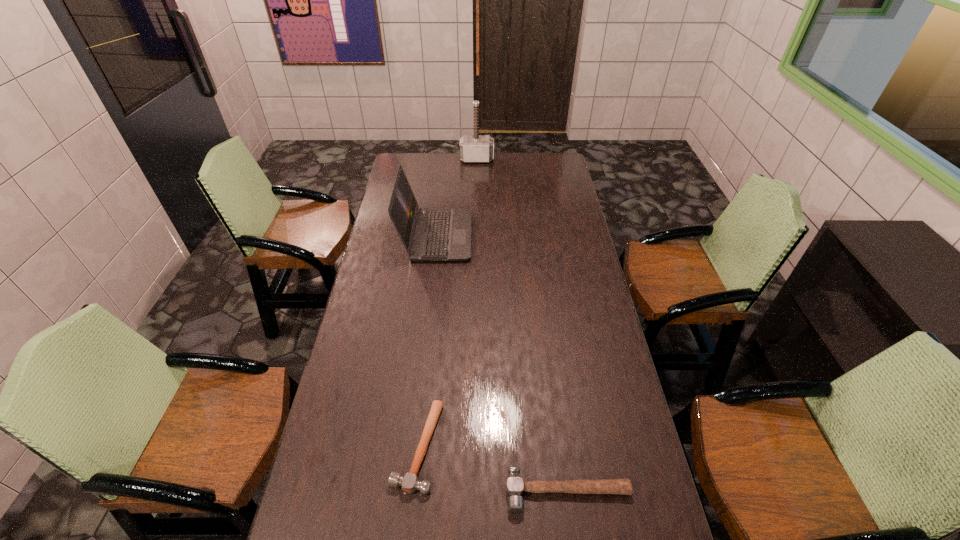
You are a GUI agent. You are given a task and a screenshot of the screen. Output one action in this format:
    pyautogui.click(x=<x>, y=<y>)
    Task: Click on the farthest hammer
    
    Given the screenshot: What is the action you would take?
    pyautogui.click(x=476, y=148)

Locate an element on the screen. the tallest hammer is located at coordinates (476, 148).

Find the location of `the third shortest object`. the third shortest object is located at coordinates (428, 234).

This screenshot has width=960, height=540. I want to click on the second farthest object, so click(x=428, y=234).

Locate an element on the screen. the leftmost hammer is located at coordinates (409, 483).

Where is `blank space located for striking with the head of the tallest object`? blank space located for striking with the head of the tallest object is located at coordinates (476, 182).

Image resolution: width=960 pixels, height=540 pixels. I want to click on free location located on the screen of the third nearest object, so click(535, 236).

This screenshot has width=960, height=540. Identify the location of vacant position located on the back of the leftmost hammer. (425, 372).

Locate an element on the screen. This screenshot has width=960, height=540. object located in the far edge section of the desktop is located at coordinates 476,148.

Identify the location of object present at the left edge. (428, 234).